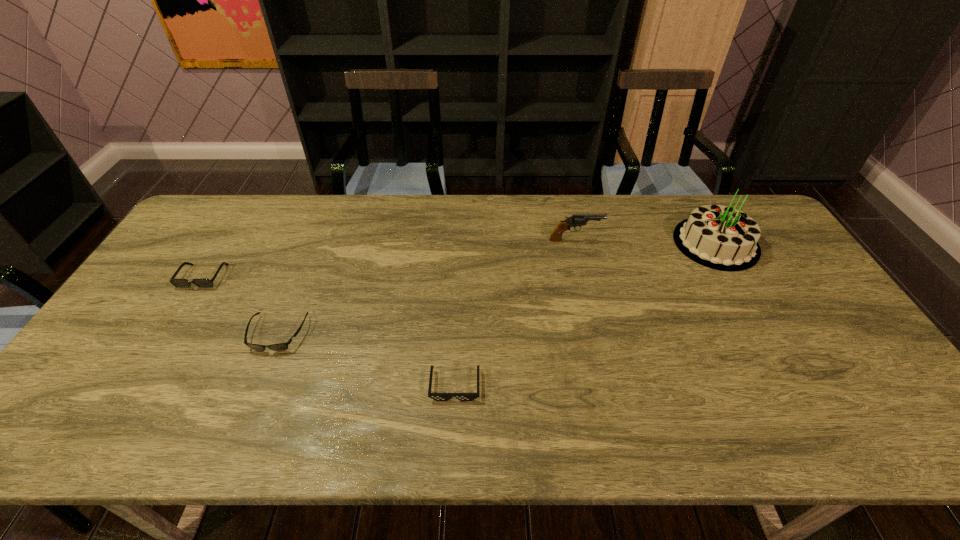
This screenshot has height=540, width=960. I want to click on the tallest object, so tap(723, 238).

Identify the location of birthday cake. pyautogui.click(x=723, y=238).

At what (x,y) coordinates should I click in order to perform the action: click on gun. Please return your answer as a coordinate pair (x, y). The width and height of the screenshot is (960, 540). Looking at the image, I should click on (575, 220).

I want to click on the second object from right to left, so click(x=575, y=220).

The image size is (960, 540). I want to click on the farthest sunglasses, so click(179, 283).

Identify the location of the leftmost object. The height and width of the screenshot is (540, 960). (179, 283).

At what (x,y) coordinates should I click in order to perform the action: click on the second object from left to right. Please return your answer as a coordinate pair (x, y). The width and height of the screenshot is (960, 540). Looking at the image, I should click on (280, 346).

This screenshot has height=540, width=960. Identify the location of the second sunglasses from left to right. (280, 346).

The height and width of the screenshot is (540, 960). What are the coordinates of `the third object from right to left` in the screenshot? It's located at (436, 396).

Image resolution: width=960 pixels, height=540 pixels. In order to click on the shortest sunglasses in this screenshot , I will do `click(436, 396)`.